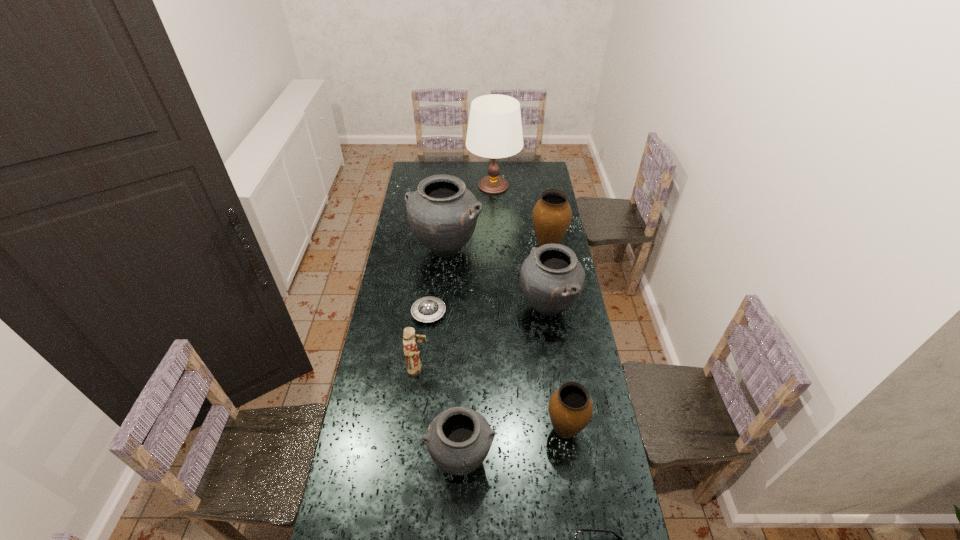
At what (x,y) coordinates should I click in order to perform the action: click on lamp. Please return your answer as a coordinate pair (x, y). The image size is (960, 540). Looking at the image, I should click on 494,131.

Find the location of a particular element. This screenshot has height=540, width=960. the farthest object is located at coordinates (494, 131).

Find the location of a particular element. The width and height of the screenshot is (960, 540). the biggest black urn is located at coordinates (442, 213).

The image size is (960, 540). Find the location of `the farthest black urn`. the farthest black urn is located at coordinates (442, 213).

Identify the location of the bigger brown urn. (552, 214).

Image resolution: width=960 pixels, height=540 pixels. What are the coordinates of `the third nearest urn` in the screenshot? It's located at (551, 278).

This screenshot has width=960, height=540. Find the location of `the second farthest black urn`. the second farthest black urn is located at coordinates (551, 278).

Locate an element on the screen. The height and width of the screenshot is (540, 960). figurine is located at coordinates (414, 365).

This screenshot has width=960, height=540. Find the location of `the nearer brown urn`. the nearer brown urn is located at coordinates (570, 408).

I want to click on the nearest black urn, so click(x=458, y=439).